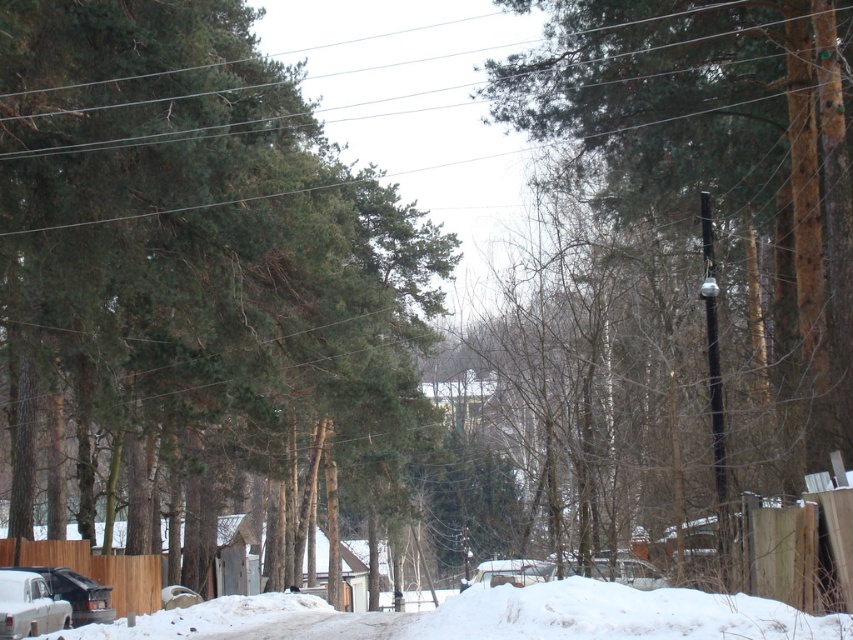
Question: Can you confirm if snow-covered sedan at lower left is positioned to the left of matte black car at lower left?

Choices:
 (A) no
 (B) yes

Answer: (A)

Question: Which of the following is the closest to the observer?

Choices:
 (A) white fluffy snow at lower left
 (B) snow-covered sedan at lower left
 (C) matte black car at lower left

Answer: (A)

Question: Which point is farther to the camera?

Choices:
 (A) matte black car at lower left
 (B) snow-covered sedan at lower left

Answer: (A)

Question: Which of the following is the farthest from the observer?

Choices:
 (A) (62, 579)
 (B) (601, 131)
 (C) (184, 84)

Answer: (A)

Question: Can you confirm if white fluffy snow at lower left is smaller than matte black car at lower left?

Choices:
 (A) yes
 (B) no

Answer: (B)

Question: Is green matte tree at center positioned in front of white fluffy snow at lower left?

Choices:
 (A) no
 (B) yes

Answer: (A)